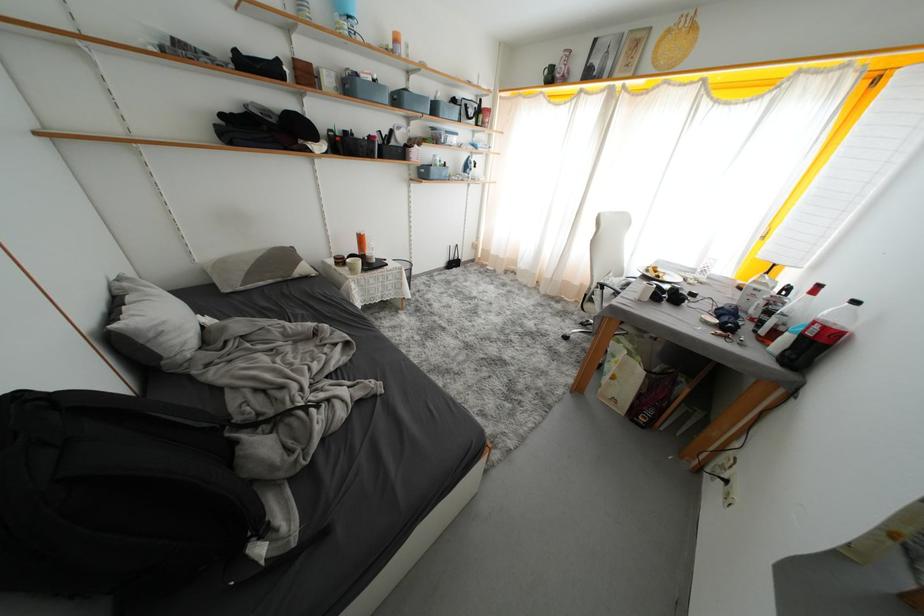
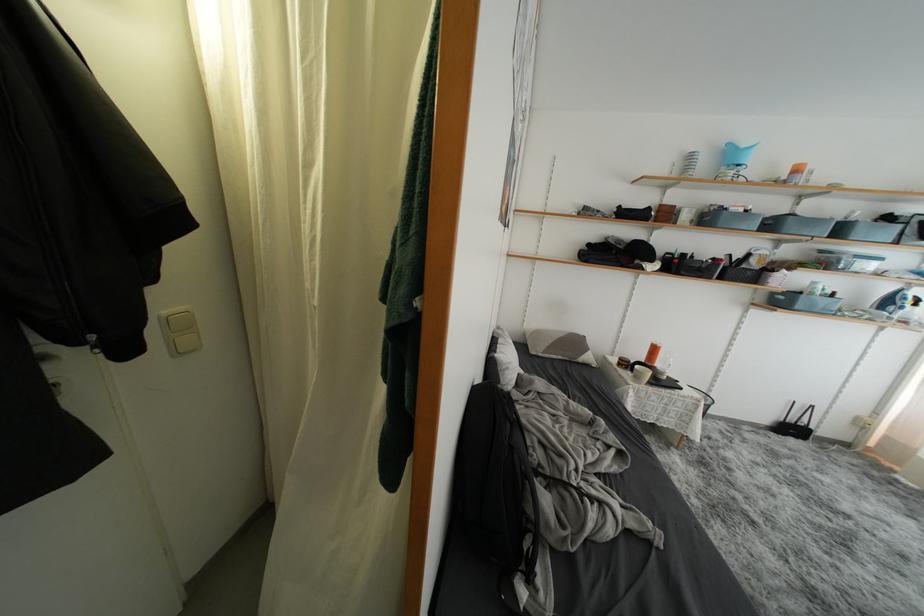
Locate, in the second image, the point that corresponds to (x=420, y=179) in the first image.

(767, 304)